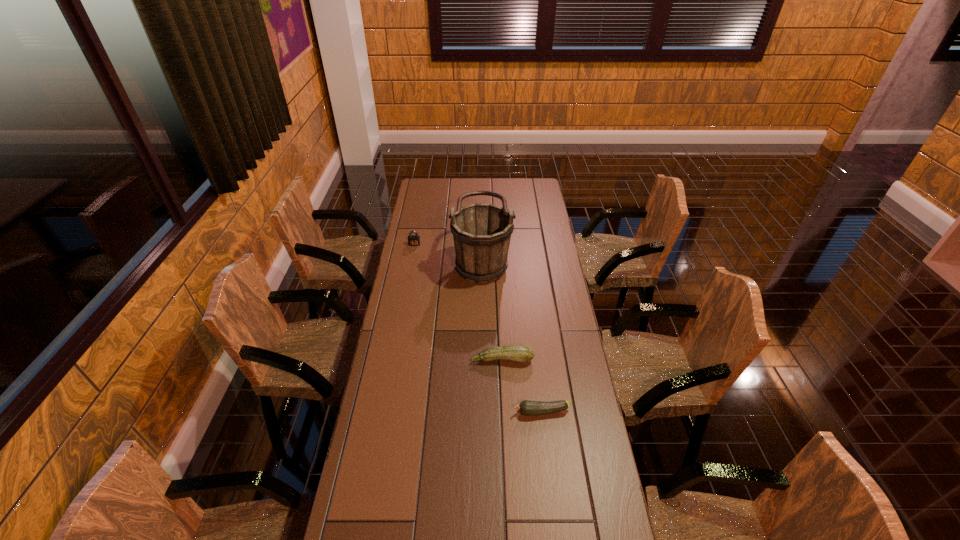
Locate an element on the screen. The width and height of the screenshot is (960, 540). vacant area that lies between the third farthest object and the leftmost object is located at coordinates (458, 302).

Find the location of a particular element. The width and height of the screenshot is (960, 540). empty space that is in between the padlock and the bucket is located at coordinates [x=448, y=252].

Locate an element on the screen. The width and height of the screenshot is (960, 540). free area in between the bucket and the third tallest object is located at coordinates (492, 309).

Where is `free point between the second shortest object and the shorter zucchini`? free point between the second shortest object and the shorter zucchini is located at coordinates (522, 386).

Where is `free area in between the tallest object and the padlock`? The image size is (960, 540). free area in between the tallest object and the padlock is located at coordinates 448,252.

Where is `free space between the second shortest object and the bucket`? The image size is (960, 540). free space between the second shortest object and the bucket is located at coordinates (492, 309).

Image resolution: width=960 pixels, height=540 pixels. Find the location of `free spot between the nearer zucchini and the taller zucchini`. free spot between the nearer zucchini and the taller zucchini is located at coordinates (522, 386).

Locate an element on the screen. object that is the second nearest to the bucket is located at coordinates (518, 353).

Identify which object is the second nearest to the bucket. Please provide its 2D coordinates. Your answer should be formatted as a tuple, i.e. [(x, y)], where the tuple contains the x and y coordinates of a point satisfying the conditions above.

[(518, 353)]

Locate which zucchini ranks in proximity to the tallest object. Please provide its 2D coordinates. Your answer should be formatted as a tuple, i.e. [(x, y)], where the tuple contains the x and y coordinates of a point satisfying the conditions above.

[(518, 353)]